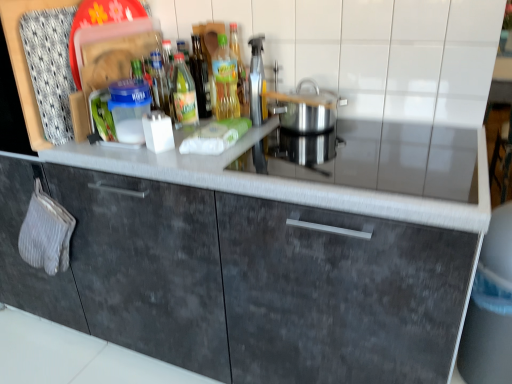
Question: Does smooth gray countertop at center have a smaller size compared to silver metallic pot at center?

Choices:
 (A) yes
 (B) no

Answer: (B)

Question: Could you tell me if smooth gray countertop at center is facing silver metallic pot at center?

Choices:
 (A) no
 (B) yes

Answer: (A)

Question: Considering the relative sizes of smooth gray countertop at center and silver metallic pot at center in the image provided, is smooth gray countertop at center taller than silver metallic pot at center?

Choices:
 (A) yes
 (B) no

Answer: (B)

Question: Can you confirm if smooth gray countertop at center is positioned to the right of silver metallic pot at center?

Choices:
 (A) yes
 (B) no

Answer: (A)

Question: Is smooth gray countertop at center facing away from silver metallic pot at center?

Choices:
 (A) yes
 (B) no

Answer: (B)

Question: Considering the positions of silver metallic pot at center and translucent plastic bottle at center, the second bottle when ordered from left to right, in the image, is silver metallic pot at center wider or thinner than translucent plastic bottle at center, the second bottle when ordered from left to right,?

Choices:
 (A) thin
 (B) wide

Answer: (B)

Question: Looking at the image, does silver metallic pot at center seem bigger or smaller compared to translucent plastic bottle at center, the second bottle when ordered from left to right?

Choices:
 (A) big
 (B) small

Answer: (A)

Question: Considering the relative positions of silver metallic pot at center and translucent plastic bottle at center, the 1th bottle when ordered from right to left, in the image provided, is silver metallic pot at center to the left or to the right of translucent plastic bottle at center, the 1th bottle when ordered from right to left,?

Choices:
 (A) right
 (B) left

Answer: (A)

Question: Is silver metallic pot at center taller or shorter than translucent plastic bottle at center, the second bottle when ordered from left to right?

Choices:
 (A) short
 (B) tall

Answer: (A)

Question: Do you think green glass bottle at center, which ranks as the second bottle in right-to-left order, is within silver metallic pot at center, or outside of it?

Choices:
 (A) outside
 (B) inside

Answer: (A)

Question: Considering the positions of point (176, 76) and point (327, 124), is point (176, 76) closer or farther from the camera than point (327, 124)?

Choices:
 (A) closer
 (B) farther

Answer: (B)

Question: Considering the positions of green glass bottle at center, the 1th bottle in the left-to-right sequence, and silver metallic pot at center in the image, is green glass bottle at center, the 1th bottle in the left-to-right sequence, wider or thinner than silver metallic pot at center?

Choices:
 (A) thin
 (B) wide

Answer: (A)

Question: Based on their sizes in the image, would you say green glass bottle at center, the 1th bottle in the left-to-right sequence, is bigger or smaller than silver metallic pot at center?

Choices:
 (A) big
 (B) small

Answer: (B)

Question: Is point (189, 89) closer or farther from the camera than point (115, 160)?

Choices:
 (A) farther
 (B) closer

Answer: (A)

Question: From the image's perspective, is green glass bottle at center, which ranks as the second bottle in right-to-left order, positioned above or below smooth gray countertop at center?

Choices:
 (A) below
 (B) above

Answer: (B)